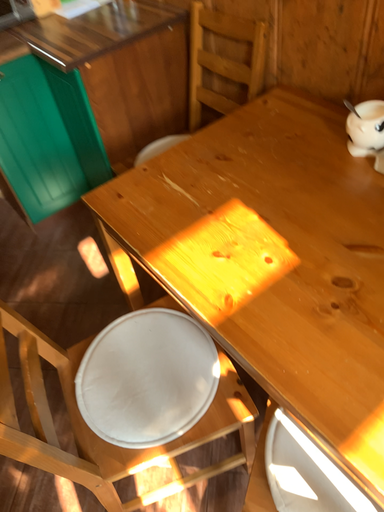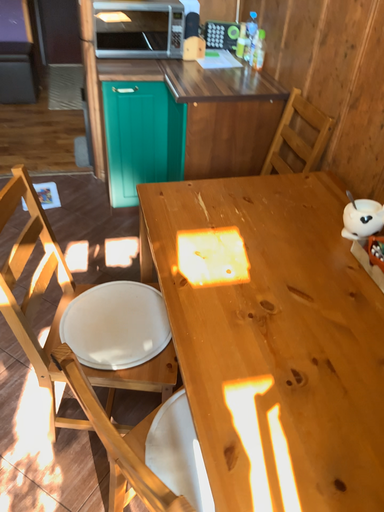
Question: Which way did the camera rotate in the video?

Choices:
 (A) rotated upward
 (B) rotated downward

Answer: (A)